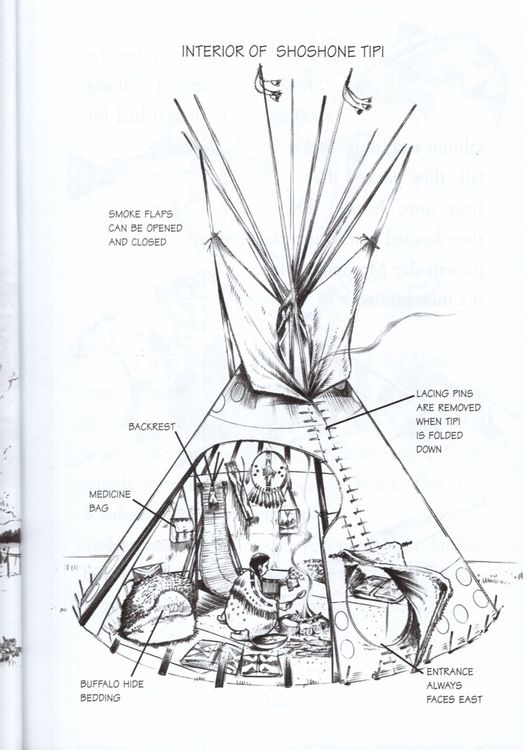
Identify the location of drawing of backrest. This screenshot has height=750, width=523. (214, 544).